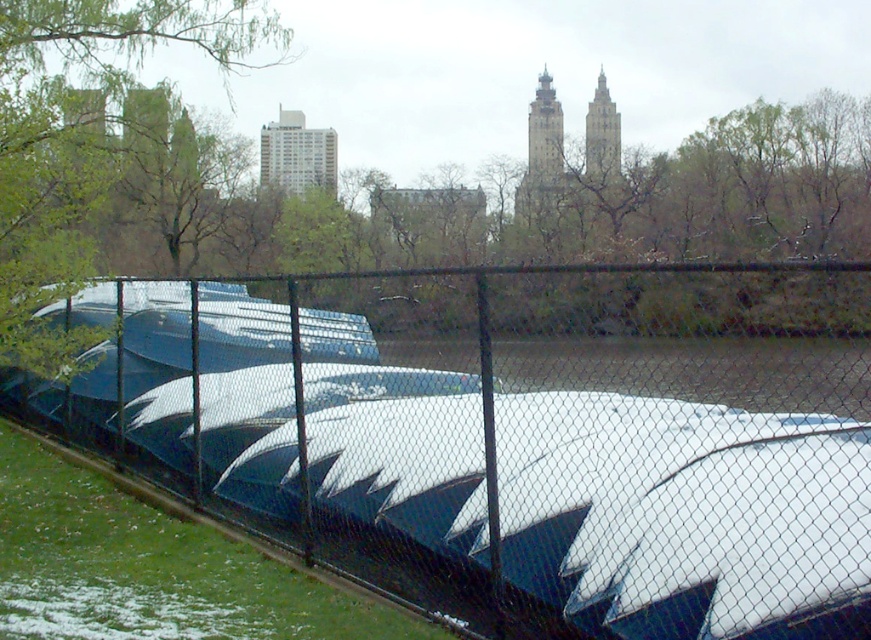
Question: Does black chain-link fence at center appear on the right side of green leafy tree at upper left?

Choices:
 (A) no
 (B) yes

Answer: (B)

Question: Which point is closer to the camera?

Choices:
 (A) (1, 246)
 (B) (393, 513)

Answer: (B)

Question: Which of the following is the closest to the observer?

Choices:
 (A) (606, 305)
 (B) (26, 260)

Answer: (B)

Question: Which point appears closest to the camera in this image?

Choices:
 (A) (784, 348)
 (B) (198, 10)

Answer: (B)

Question: Is black chain-link fence at center below green leafy tree at upper left?

Choices:
 (A) no
 (B) yes

Answer: (B)

Question: Can you confirm if black chain-link fence at center is wider than green leafy tree at upper left?

Choices:
 (A) yes
 (B) no

Answer: (A)